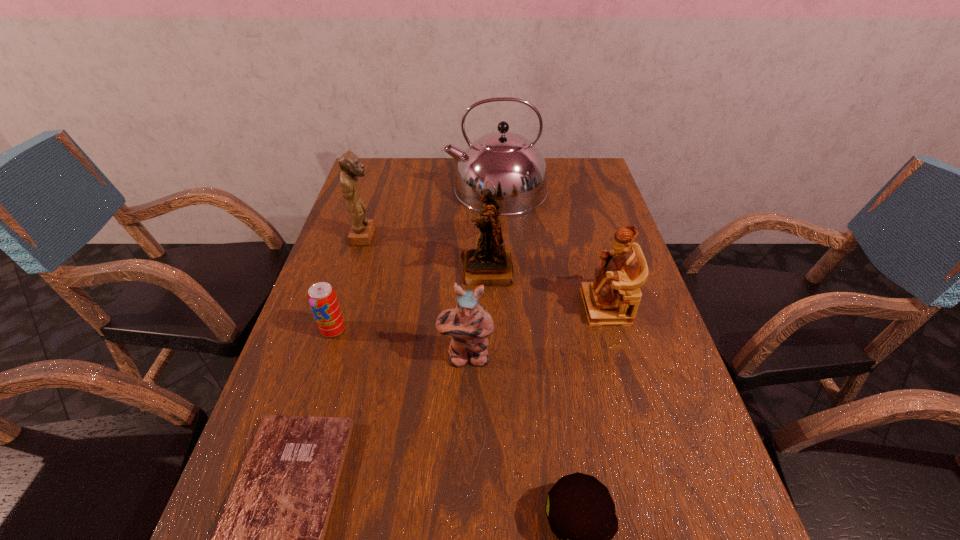
This screenshot has height=540, width=960. I want to click on kettle, so click(516, 167).

In order to click on the farthest figurine in this screenshot , I will do `click(362, 230)`.

Find the location of a particular element. The width and height of the screenshot is (960, 540). the seventh nearest object is located at coordinates (362, 230).

The height and width of the screenshot is (540, 960). In order to click on the rightmost object in this screenshot , I will do `click(613, 298)`.

Where is `the third nearest object`? the third nearest object is located at coordinates (469, 324).

Locate an element on the screen. soda can is located at coordinates (322, 297).

Where is `free space located from the spout of the farthest object`? free space located from the spout of the farthest object is located at coordinates (419, 190).

The image size is (960, 540). I want to click on vacant area located from the spout of the farthest object, so click(377, 190).

This screenshot has width=960, height=540. What are the coordinates of `blank space located from the spout of the farthest object` in the screenshot? It's located at (386, 190).

You are a GUI agent. You are given a task and a screenshot of the screen. Output one action in this format:
    pyautogui.click(x=<x>, y=<y>)
    Task: Click on the free space located 0.270m on the front-facing side of the second farthest object
    This screenshot has width=960, height=540.
    Given the screenshot: What is the action you would take?
    pyautogui.click(x=468, y=237)